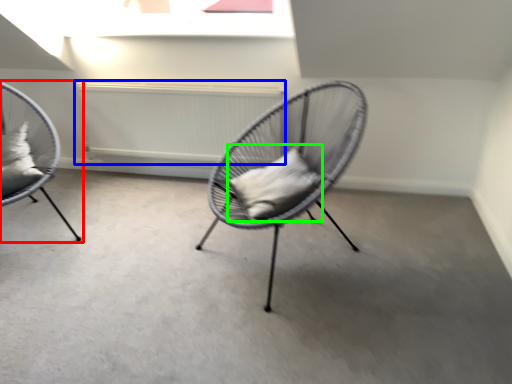
Question: Which is nearer to the chair (highlighted by a red box)? radiator (highlighted by a blue box) or pillow (highlighted by a green box).

Choices:
 (A) radiator
 (B) pillow

Answer: (A)